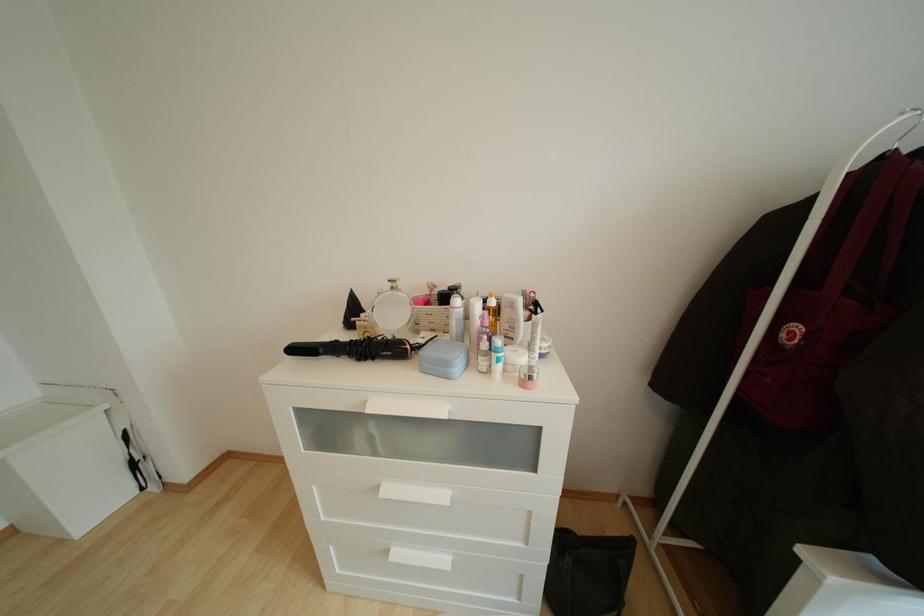
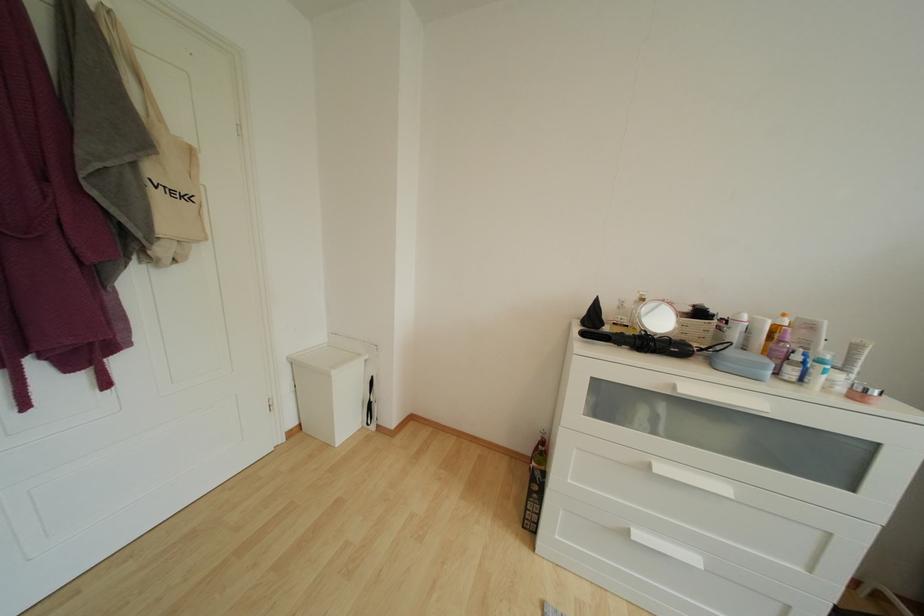
Find the pixel in the second image that matches pixel 400 557 in the first image.

(642, 540)